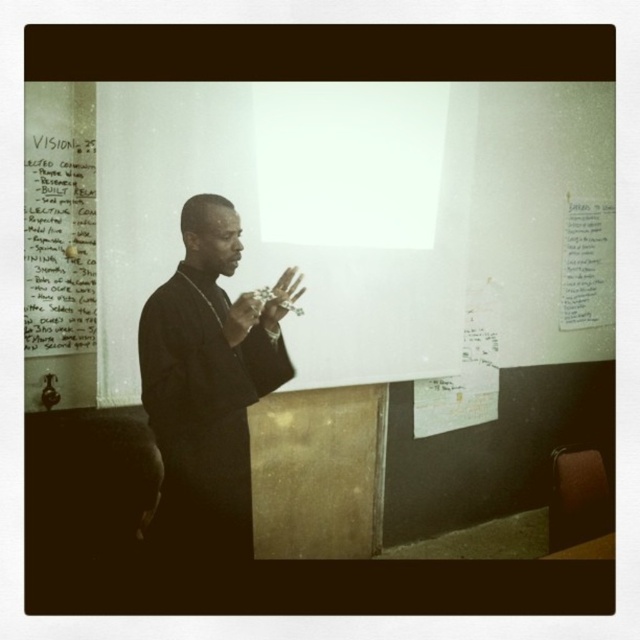
Question: Is black matte suit at center positioned in front of white matte hand at center?

Choices:
 (A) no
 (B) yes

Answer: (B)

Question: Which point is farther to the camera?

Choices:
 (A) (26, 230)
 (B) (259, 300)
 (C) (221, 314)
 (D) (291, 300)

Answer: (A)

Question: From the image, what is the correct spatial relationship of white matte hand at center in relation to smooth skin hand at center?

Choices:
 (A) left
 (B) right

Answer: (B)

Question: Among these points, which one is farthest from the camera?

Choices:
 (A) (83, 221)
 (B) (212, 243)

Answer: (A)

Question: Can you confirm if black matte suit at center is positioned to the right of white paper at upper left?

Choices:
 (A) no
 (B) yes

Answer: (B)

Question: Among these points, which one is farthest from the camera?

Choices:
 (A) (269, 346)
 (B) (253, 310)
 (C) (266, 317)
 (D) (51, 346)

Answer: (D)